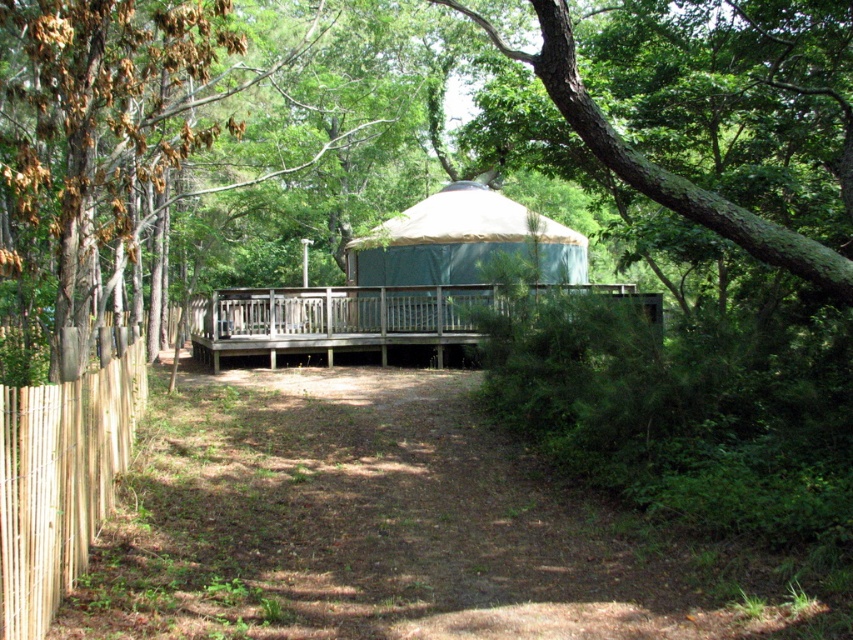
Question: Observing the image, what is the correct spatial positioning of green leafy tree at center in reference to light brown wooden fence at left?

Choices:
 (A) right
 (B) left

Answer: (A)

Question: Which point is farther from the camera taking this photo?

Choices:
 (A) (27, 547)
 (B) (730, 202)
 (C) (202, 339)

Answer: (C)

Question: Does green leafy tree at center have a larger size compared to light brown wooden fence at left?

Choices:
 (A) no
 (B) yes

Answer: (B)

Question: Does green leafy tree at center have a lesser width compared to beige canvas yurt at center?

Choices:
 (A) no
 (B) yes

Answer: (A)

Question: Which object is closer to the camera taking this photo?

Choices:
 (A) green rough bark tree at upper center
 (B) wooden deck at center
 (C) beige canvas yurt at center

Answer: (A)

Question: Which object appears farthest from the camera in this image?

Choices:
 (A) wooden deck at center
 (B) beige canvas yurt at center

Answer: (B)